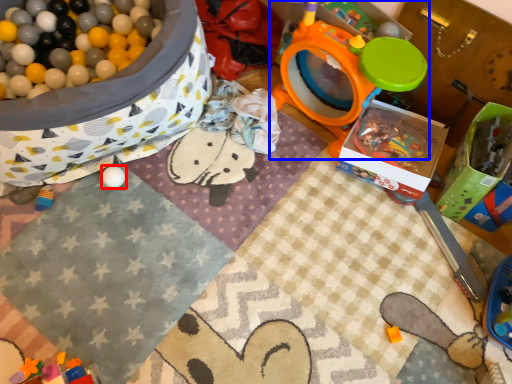
Question: Which object is closer to the camera taking this photo, toy (highlighted by a red box) or toy (highlighted by a blue box)?

Choices:
 (A) toy
 (B) toy

Answer: (B)